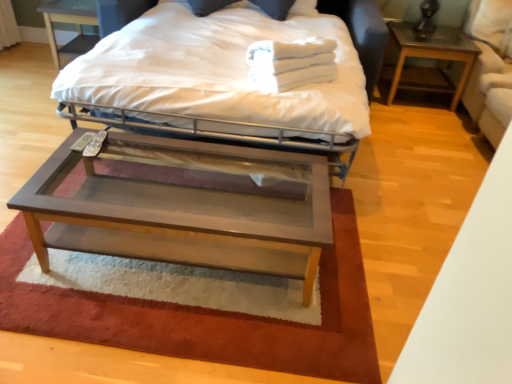
The image size is (512, 384). Describe the element at coordinates (291, 63) in the screenshot. I see `white cotton towels at upper center` at that location.

You are a GUI agent. You are given a task and a screenshot of the screen. Output one action in this format:
    pyautogui.click(x=<x>, y=<y>)
    Task: Click on the white cotton towels at upper center
    This screenshot has width=512, height=384.
    Given the screenshot: What is the action you would take?
    pyautogui.click(x=291, y=63)

The height and width of the screenshot is (384, 512). What do you see at coordinates (489, 68) in the screenshot?
I see `white fabric swivel chair at right` at bounding box center [489, 68].

You are a GUI agent. You are given a task and a screenshot of the screen. Output one action in this format:
    pyautogui.click(x=<x>, y=<y>)
    Task: Click on the brown wood nightstand at right, the first nightstand from the right
    Image resolution: width=512 pixels, height=384 pixels.
    Given the screenshot: What is the action you would take?
    pyautogui.click(x=430, y=58)

Do you think dark wood nightstand at upper left, which is counted as the 2th nightstand, starting from the right, is within white cotton towels at upper center, or outside of it?

dark wood nightstand at upper left, which is counted as the 2th nightstand, starting from the right, is located beyond the bounds of white cotton towels at upper center.

From a real-world perspective, who is located higher, dark wood nightstand at upper left, which ranks as the 1th nightstand in left-to-right order, or white cotton towels at upper center?

white cotton towels at upper center is physically above.

From the image's perspective, is dark wood nightstand at upper left, which is counted as the 2th nightstand, starting from the right, under white cotton towels at upper center?

Actually, dark wood nightstand at upper left, which is counted as the 2th nightstand, starting from the right, appears above white cotton towels at upper center in the image.

Which object is wider, dark wood nightstand at upper left, which is counted as the 2th nightstand, starting from the right, or white cotton towels at upper center?

Wider between the two is dark wood nightstand at upper left, which is counted as the 2th nightstand, starting from the right.

Considering the sizes of objects dark wood nightstand at upper left, which is counted as the 2th nightstand, starting from the right, and matte white bed at center in the image provided, who is smaller, dark wood nightstand at upper left, which is counted as the 2th nightstand, starting from the right, or matte white bed at center?

With smaller size is dark wood nightstand at upper left, which is counted as the 2th nightstand, starting from the right.

From a real-world perspective, which is physically above, dark wood nightstand at upper left, which ranks as the 1th nightstand in left-to-right order, or matte white bed at center?

matte white bed at center.

Would you say dark wood nightstand at upper left, which ranks as the 1th nightstand in left-to-right order, is outside matte white bed at center?

Yes, dark wood nightstand at upper left, which ranks as the 1th nightstand in left-to-right order, is not within matte white bed at center.

Is brown plush rug at center placed right next to wooden glass coffee table at center?

No, brown plush rug at center is not in contact with wooden glass coffee table at center.

Is brown plush rug at center facing away from wooden glass coffee table at center?

brown plush rug at center is not turned away from wooden glass coffee table at center.

How distant is brown plush rug at center from wooden glass coffee table at center?

The distance of brown plush rug at center from wooden glass coffee table at center is 13.68 inches.

Is wooden glass coffee table at center surrounded by brown plush rug at center?

No, wooden glass coffee table at center is located outside of brown plush rug at center.

From the image's perspective, which is below, white fabric swivel chair at right or matte white bed at center?

matte white bed at center, from the image's perspective.

Based on their positions, is white fabric swivel chair at right located to the left or right of matte white bed at center?

Clearly, white fabric swivel chair at right is on the right of matte white bed at center in the image.

I want to click on swivel chair that appears above the matte white bed at center (from the image's perspective), so click(x=489, y=68).

Is white fabric swivel chair at right next to matte white bed at center and touching it?

No, white fabric swivel chair at right is not next to matte white bed at center.

You are a GUI agent. You are given a task and a screenshot of the screen. Output one action in this format:
    pyautogui.click(x=<x>, y=<y>)
    Task: Click on the swivel chair behind the wooden glass coffee table at center
    
    Given the screenshot: What is the action you would take?
    pyautogui.click(x=489, y=68)

Does point (474, 76) come closer to viewer compared to point (47, 249)?

No.

Between white fabric swivel chair at right and wooden glass coffee table at center, which one appears on the left side from the viewer's perspective?

wooden glass coffee table at center.

Are white fabric swivel chair at right and wooden glass coffee table at center making contact?

white fabric swivel chair at right is not next to wooden glass coffee table at center, and they're not touching.

Could you tell me if brown plush rug at center is turned towards white fabric swivel chair at right?

No, brown plush rug at center does not turn towards white fabric swivel chair at right.

Considering the sizes of objects brown plush rug at center and white fabric swivel chair at right in the image provided, who is smaller, brown plush rug at center or white fabric swivel chair at right?

brown plush rug at center.

Looking at their sizes, would you say brown plush rug at center is wider or thinner than white fabric swivel chair at right?

Considering their sizes, brown plush rug at center looks broader than white fabric swivel chair at right.

Consider the image. How distant is brown plush rug at center from white fabric swivel chair at right?

A distance of 1.98 meters exists between brown plush rug at center and white fabric swivel chair at right.

Considering the sizes of objects white fabric swivel chair at right and white cotton towels at upper center in the image provided, who is taller, white fabric swivel chair at right or white cotton towels at upper center?

Standing taller between the two is white fabric swivel chair at right.

Looking at this image, from the image's perspective, which one is positioned lower, white fabric swivel chair at right or white cotton towels at upper center?

white cotton towels at upper center is shown below in the image.

How much distance is there between white fabric swivel chair at right and white cotton towels at upper center?

They are 1.46 meters apart.

Consider the image. From a real-world perspective, between white fabric swivel chair at right and white cotton towels at upper center, who is vertically higher?

white cotton towels at upper center.

Find the location of a particular element. The image size is (512, 384). the 2nd nightstand positioned above the white cotton towels at upper center (from the image's perspective) is located at coordinates (70, 23).

From a real-world perspective, count 1st nightstands downward from the matte white bed at center and point to it. Please provide its 2D coordinates.

[(70, 23)]

Estimate the real-world distances between objects in this image. Which object is closer to wooden glass coffee table at center, white cotton towels at upper center or white fabric swivel chair at right?

The object closer to wooden glass coffee table at center is white cotton towels at upper center.

From the image, which object appears to be farther from dark wood nightstand at upper left, which ranks as the 1th nightstand in left-to-right order, brown wood nightstand at right, which is the second nightstand from left to right, or brown plush rug at center?

The object further to dark wood nightstand at upper left, which ranks as the 1th nightstand in left-to-right order, is brown wood nightstand at right, which is the second nightstand from left to right.

Estimate the real-world distances between objects in this image. Which object is closer to white cotton towels at upper center, brown plush rug at center or brown wood nightstand at right, which is the second nightstand from left to right?

Based on the image, brown plush rug at center appears to be nearer to white cotton towels at upper center.

Based on their spatial positions, is brown plush rug at center or brown wood nightstand at right, which is the second nightstand from left to right, further from white fabric swivel chair at right?

brown plush rug at center is positioned further to the anchor white fabric swivel chair at right.

Consider the image. Looking at the image, which one is located further to matte white bed at center, wooden glass coffee table at center or brown wood nightstand at right, the first nightstand from the right?

Based on the image, brown wood nightstand at right, the first nightstand from the right, appears to be further to matte white bed at center.

Considering their positions, is dark wood nightstand at upper left, which is counted as the 2th nightstand, starting from the right, positioned closer to white fabric swivel chair at right than brown wood nightstand at right, the first nightstand from the right?

brown wood nightstand at right, the first nightstand from the right, is closer to white fabric swivel chair at right.

Based on their spatial positions, is white fabric swivel chair at right or brown wood nightstand at right, which is the second nightstand from left to right, further from brown plush rug at center?

Among the two, brown wood nightstand at right, which is the second nightstand from left to right, is located further to brown plush rug at center.

From the image, which object appears to be nearer to dark wood nightstand at upper left, which is counted as the 2th nightstand, starting from the right, brown wood nightstand at right, the first nightstand from the right, or matte white bed at center?

matte white bed at center is positioned closer to the anchor dark wood nightstand at upper left, which is counted as the 2th nightstand, starting from the right.

You are a GUI agent. You are given a task and a screenshot of the screen. Output one action in this format:
    pyautogui.click(x=<x>, y=<y>)
    Task: Click on the material located between brown plush rug at center and white fabric swivel chair at right in the left-right direction
    This screenshot has height=384, width=512.
    Given the screenshot: What is the action you would take?
    pyautogui.click(x=291, y=63)

At what (x,y) coordinates should I click in order to perform the action: click on material located between dark wood nightstand at upper left, which ranks as the 1th nightstand in left-to-right order, and brown wood nightstand at right, the first nightstand from the right, in the left-right direction. Please return your answer as a coordinate pair (x, y). Looking at the image, I should click on (291, 63).

At what (x,y) coordinates should I click in order to perform the action: click on material between brown plush rug at center and brown wood nightstand at right, which is the second nightstand from left to right, in the horizontal direction. Please return your answer as a coordinate pair (x, y). The image size is (512, 384). Looking at the image, I should click on (291, 63).

Image resolution: width=512 pixels, height=384 pixels. What are the coordinates of `bed between dark wood nightstand at upper left, which ranks as the 1th nightstand in left-to-right order, and white cotton towels at upper center, in the horizontal direction` in the screenshot? It's located at (237, 75).